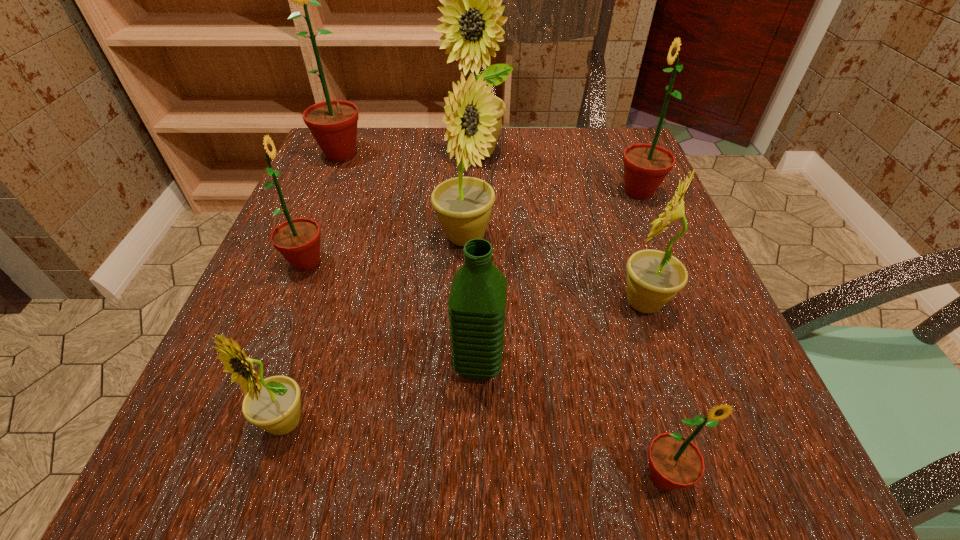
You are a GUI agent. You are given a task and a screenshot of the screen. Output one action in this format:
    pyautogui.click(x=<x>, y=<y>)
    Task: Click on the farthest yellow sunflower
    This screenshot has height=540, width=960.
    Given the screenshot: What is the action you would take?
    pyautogui.click(x=472, y=12)

Locate an element on the screen. The height and width of the screenshot is (540, 960). the biggest green sunflower is located at coordinates (333, 123).

At what (x,y) coordinates should I click in order to perform the action: click on the third nearest yellow sunflower. Please return your answer as a coordinate pair (x, y). Looking at the image, I should click on coord(463,204).

At what (x,y) coordinates should I click in order to perform the action: click on the third nearest green sunflower. Please return your answer as a coordinate pair (x, y). This screenshot has width=960, height=540. Looking at the image, I should click on (645, 165).

At what (x,y) coordinates should I click in order to perform the action: click on the third farthest object. Please return your answer as a coordinate pair (x, y). Looking at the image, I should click on (645, 165).

Where is `the second smallest yellow sunflower`? Image resolution: width=960 pixels, height=540 pixels. the second smallest yellow sunflower is located at coordinates (654, 277).

Identify the location of the second nearest yellow sunflower. Image resolution: width=960 pixels, height=540 pixels. (654, 277).

Identify the location of the third farthest green sunflower. (298, 240).

The image size is (960, 540). Find the location of `water bottle`. water bottle is located at coordinates (477, 302).

Locate an element on the screen. The image size is (960, 540). the third nearest object is located at coordinates (477, 302).